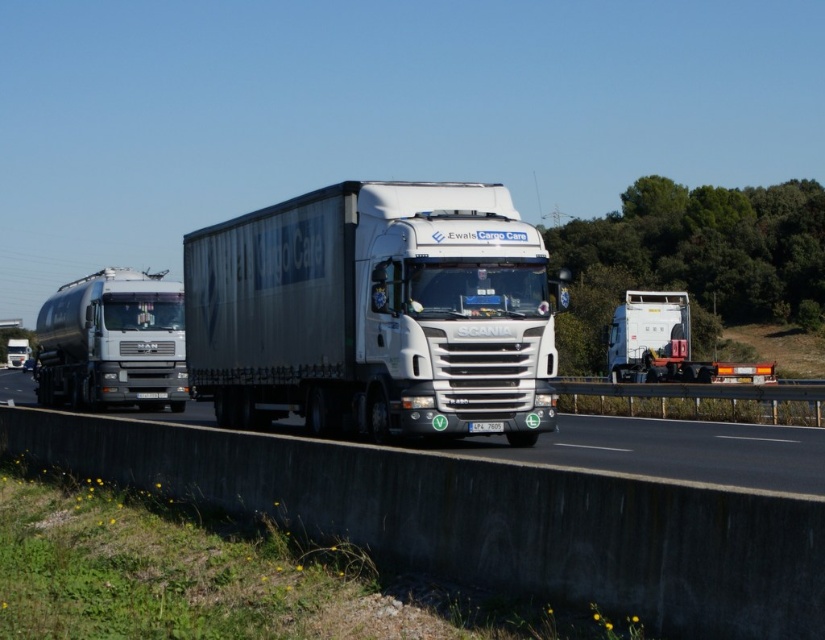
You are a traffic analyst reviewing the highway scene. The white matte trailer truck at center is at coordinates 0.491, 0.455. Is there any vehicle positioned to the left of it?

The MAN tanker truck is positioned to the left of the white matte trailer truck at center, so yes, there is a vehicle to its left.

You are a photographer trying to capture the central white Scania truck in the highway scene. You are standing at point (505,467). There is another point at (774,458). Which point is closer to you?

Point (505,467) is closer to the viewer than point (774,458).

You are a driver on the highway and see the white matte trailer truck at center and the metallic silver tanker at left. Which truck is positioned closer to the right side of the road?

The white matte trailer truck at center is positioned to the right of the metallic silver tanker at left, so it is closer to the right side of the road.